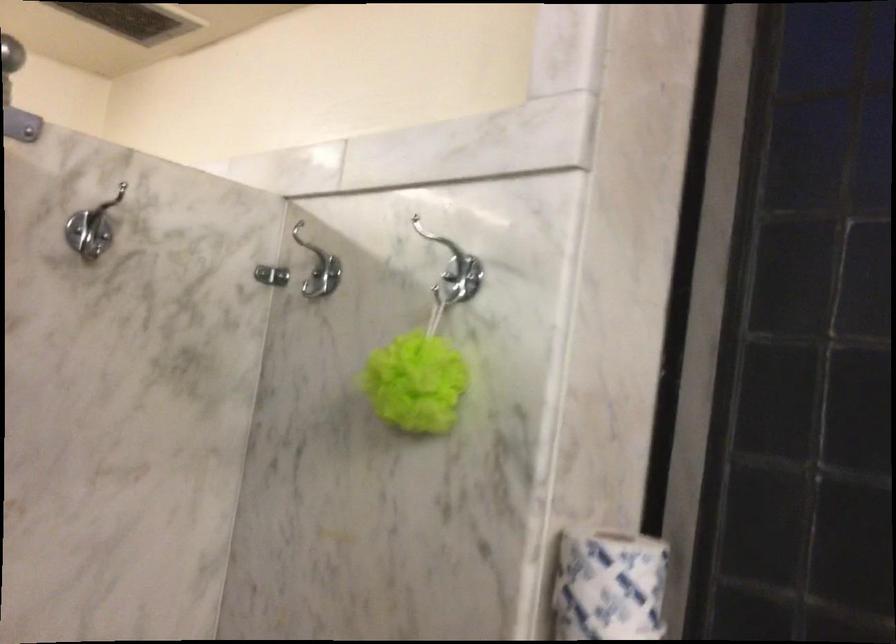
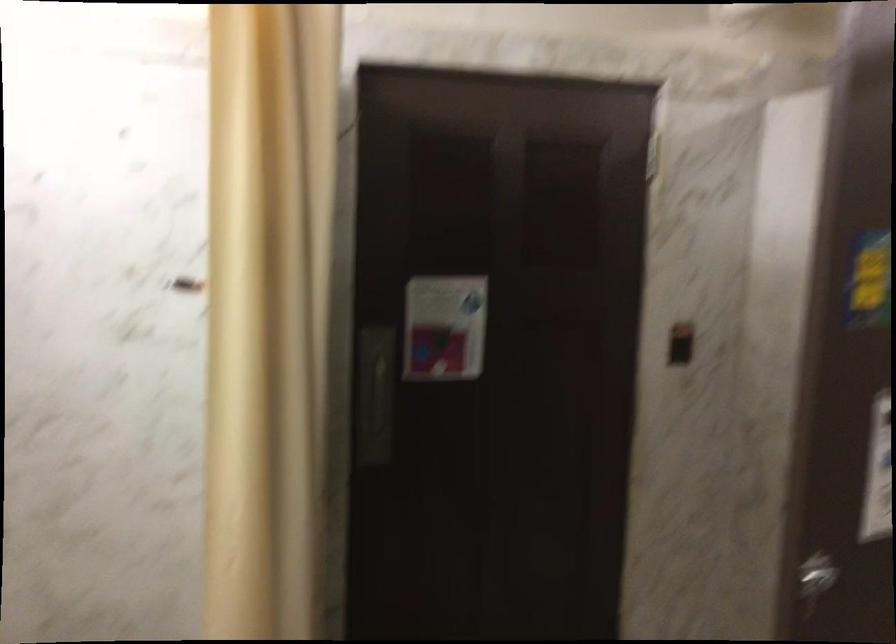
Question: The first image is from the beginning of the video and the second image is from the end. How did the camera likely rotate when shooting the video?

Choices:
 (A) Left
 (B) Right
 (C) Up
 (D) Down

Answer: (A)